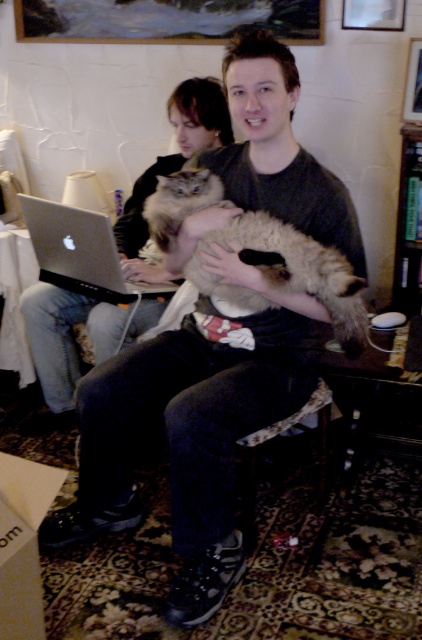
You are standing in the living room and want to place a small plant pot at the exact center of the room. The fuzzy brown cat at center is currently located at point coordinates of 0.430, 0.675. Can you confirm if the cat is exactly at the center point of the room?

The fuzzy brown cat at center is located at coordinates (284, 275), which is not the exact center point of the room. The center point of a room would typically be at coordinates (211, 320). Since the cat is at (284, 275), it is slightly to the left and lower than the true center.

From the picture: You are a veterinarian examining two cats in a living room. You notice the fluffy cat at center and the fuzzy brown cat at center. Which cat has a greater width according to your observation?

The fluffy cat at center has a greater width than the fuzzy brown cat at center.

You are trying to pet the cats in the image. The fluffy cat at center is to the left of the fuzzy brown cat at center. Which cat should you approach first if you want to start from the left side?

You should approach the fluffy cat at center first since it is positioned to the left of the fuzzy brown cat at center.